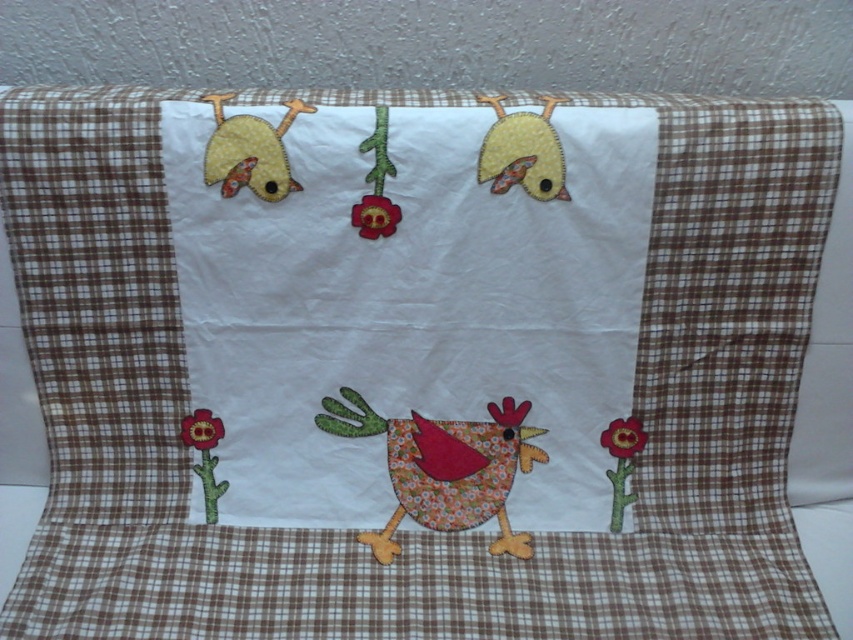
Question: Is matte yellow chicken at upper right above matte fabric flower at center?

Choices:
 (A) yes
 (B) no

Answer: (A)

Question: Which object is positioned farthest from the matte yellow chicken at upper left?

Choices:
 (A) floral fabric chicken at lower center
 (B) matte fabric flower at center
 (C) matte pink fabric flower at lower right

Answer: (C)

Question: Is matte pink fabric flower at lower right to the left of floral fabric flower at lower left from the viewer's perspective?

Choices:
 (A) yes
 (B) no

Answer: (B)

Question: Which of these objects is positioned farthest from the floral fabric flower at lower left?

Choices:
 (A) matte pink fabric flower at lower right
 (B) matte fabric flower at center

Answer: (A)

Question: Which object appears closest to the camera in this image?

Choices:
 (A) matte yellow chicken at upper right
 (B) floral fabric chicken at lower center

Answer: (A)

Question: Is matte yellow chicken at upper right bigger than matte fabric flower at center?

Choices:
 (A) no
 (B) yes

Answer: (B)